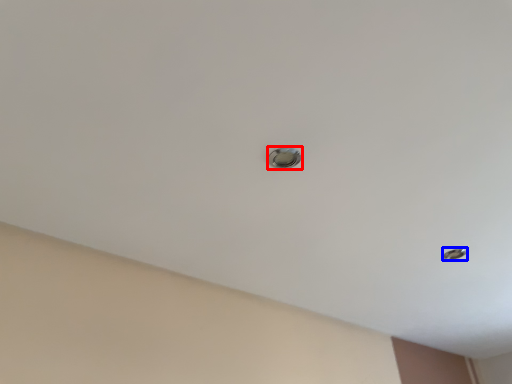
Question: Which of the following is the closest to the observer, door handle (highlighted by a red box) or hole (highlighted by a blue box)?

Choices:
 (A) door handle
 (B) hole

Answer: (A)